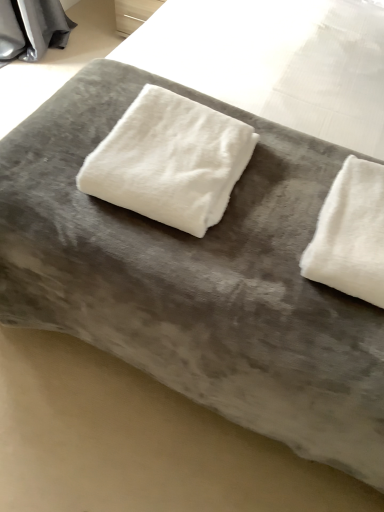
Where is `free region on the left part of white fluffy towel at center, marked as the 2th towel in a right-to-left arrangement`? Image resolution: width=384 pixels, height=512 pixels. free region on the left part of white fluffy towel at center, marked as the 2th towel in a right-to-left arrangement is located at coordinates (58, 149).